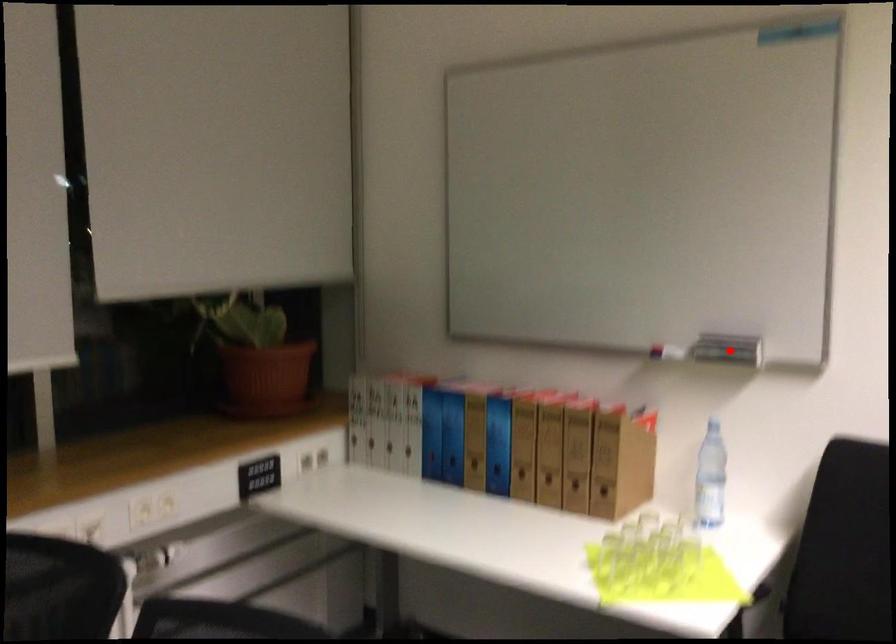
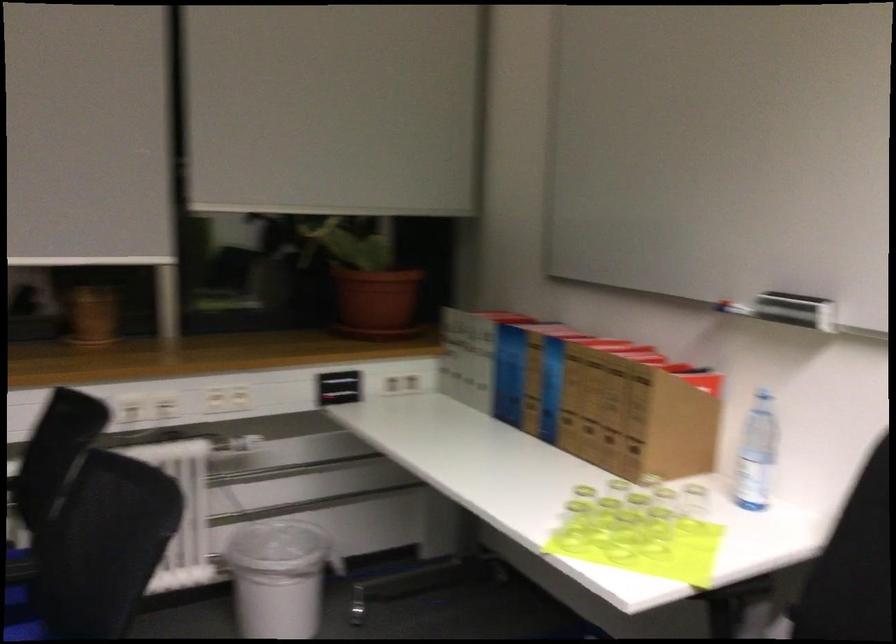
Question: I am providing you with two images of the same scene from different viewpoints. Image1 has a red point marked. In image2, the corresponding 3D location appears at what relative position? Reply with the corresponding letter.

Choices:
 (A) Closer
 (B) Farther

Answer: (A)